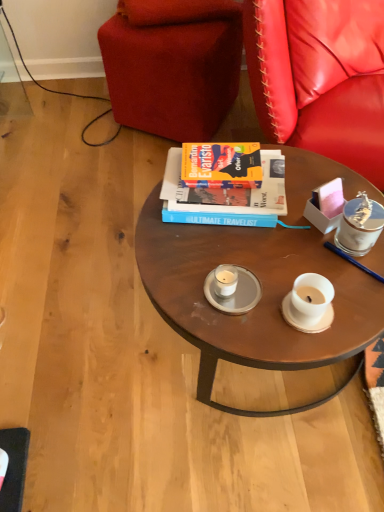
Locate an element on the screen. vacant space that is in between hardcover book at center and clear glass saucer at center is located at coordinates (233, 250).